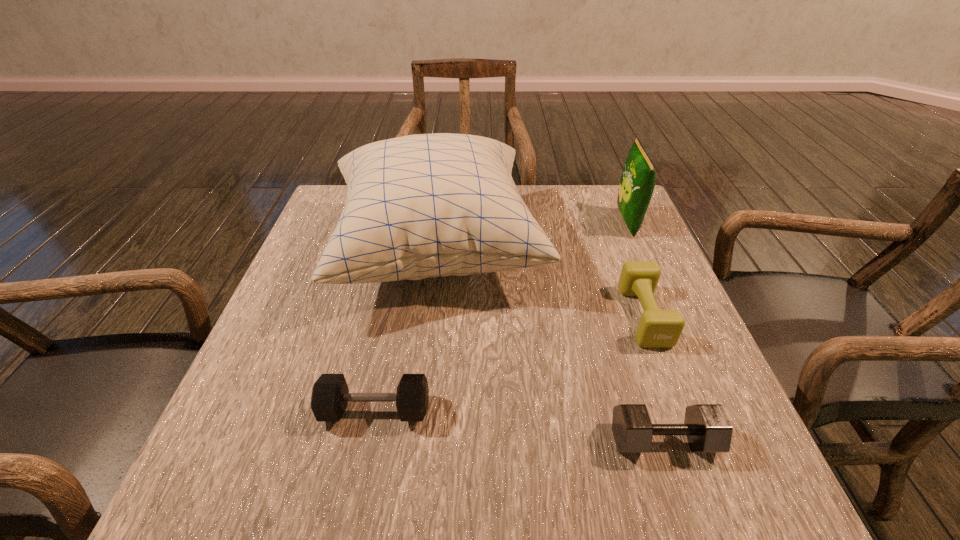
The image size is (960, 540). I want to click on the second closest dumbbell to the farthest dumbbell, so click(x=330, y=394).

The height and width of the screenshot is (540, 960). In order to click on vacant space that satisfies the following two spatial constraints: 1. on the front-facing side of the crisp (potato chip); 2. on the front side of the farthest dumbbell in this screenshot , I will do click(666, 315).

In order to click on vacant space that satisfies the following two spatial constraints: 1. on the front side of the farthest dumbbell; 2. on the right side of the tallest object in this screenshot , I will do `click(429, 315)`.

The width and height of the screenshot is (960, 540). What are the coordinates of `free space that satisfies the following two spatial constraints: 1. on the front-facing side of the crisp (potato chip); 2. on the front side of the cushion` in the screenshot? It's located at (638, 249).